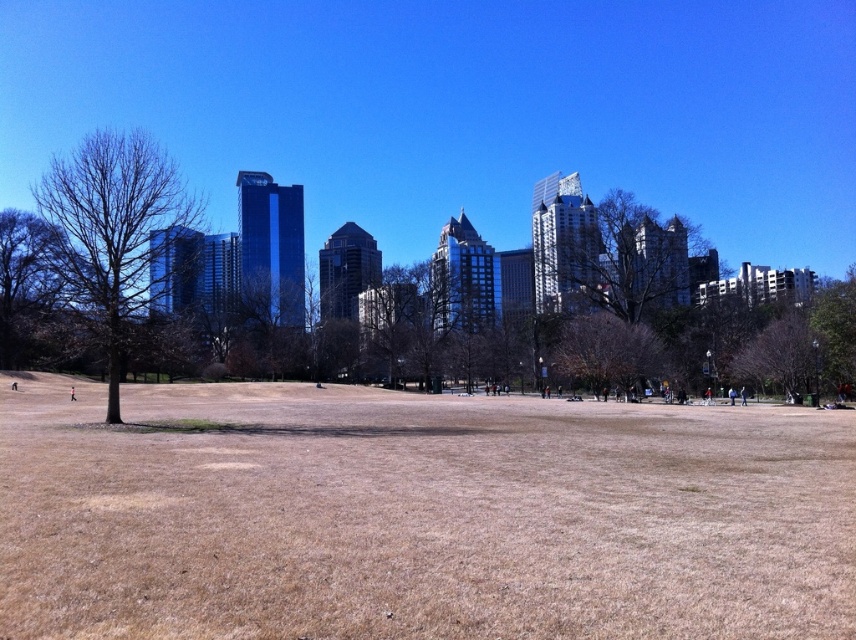
You are standing in the open field and want to take a photo of both the brown textured tree at lower right and the green leafy tree at right. Which tree should you position closer to you to include both in the frame?

To include both the brown textured tree at lower right and the green leafy tree at right in the frame, you should position yourself closer to the brown textured tree at lower right since it is shorter than the green leafy tree at right.

You are standing in the open field and want to walk towards both the brown textured tree at lower right and the green leafy tree at right. Which tree will you reach first?

You will reach the brown textured tree at lower right first because it is closer to you than the green leafy tree at right, which is further away.

You are planning to set up a picnic blanket between the bare brown tree at left and the green leafy tree at center. The picnic blanket requires a space of 150 feet to be placed. Can you fit the picnic blanket between them?

The distance between the bare brown tree at left and the green leafy tree at center is 175.33 feet, which is more than enough space to accommodate the 150 feet required for the picnic blanket.